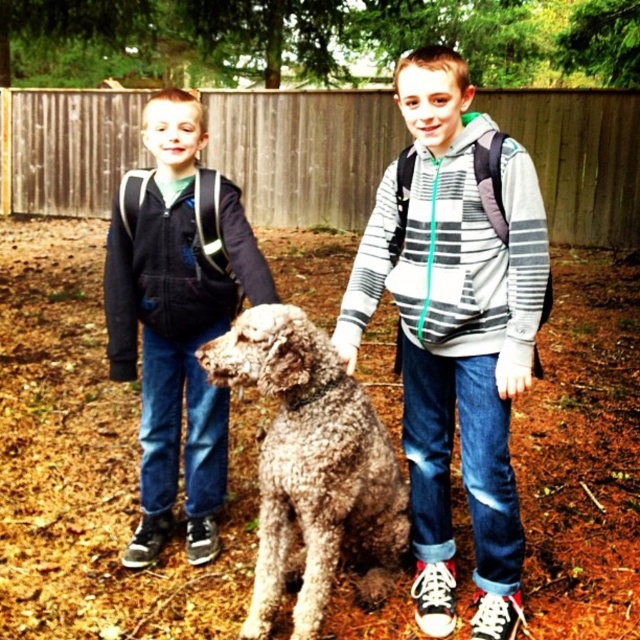
In the scene shown: You are a photographer setting up for a group photo. You notice the striped hoodie at center and the fuzzy brown dog at center are both at the center of the frame. Which one is covering the other?

The striped hoodie at center is positioned over fuzzy brown dog at center, so the striped hoodie at center is covering the fuzzy brown dog at center.

You are taking a photo of two points in a backyard scene. The first point is at coordinates point (172, 164) and the second is at point (308, 492). Which point is closer to the camera?

Point (172, 164) is closer to the camera than point (308, 492) because it is further to the camera than the second point.